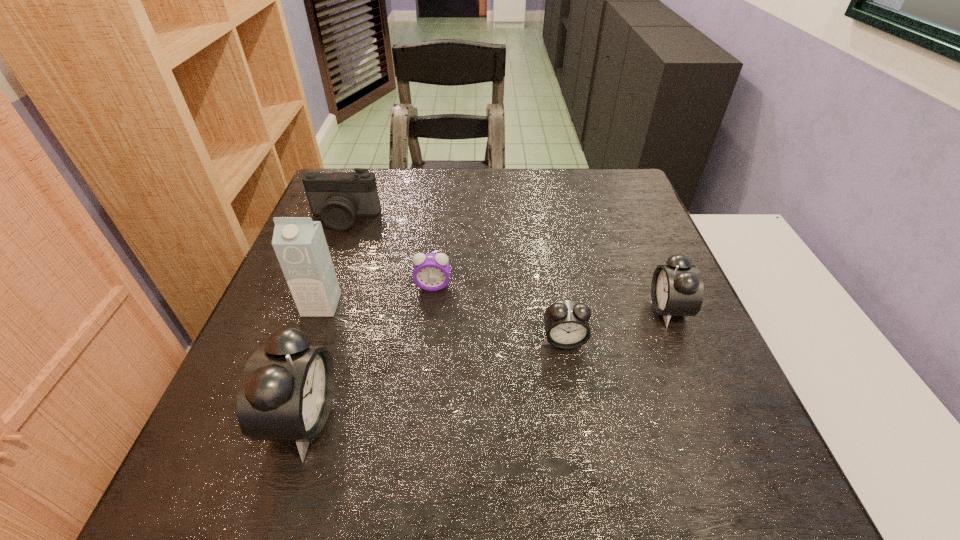
Select which alarm clock is the third closest to the third shortest alarm clock. Please provide its 2D coordinates. Your answer should be formatted as a tuple, i.e. [(x, y)], where the tuple contains the x and y coordinates of a point satisfying the conditions above.

[(286, 390)]

Locate which alarm clock ranks third in proximity to the carton. Please provide its 2D coordinates. Your answer should be formatted as a tuple, i.e. [(x, y)], where the tuple contains the x and y coordinates of a point satisfying the conditions above.

[(566, 322)]

At what (x,y) coordinates should I click in order to perform the action: click on free point that satisfies the following two spatial constraints: 1. on the face of the third alarm clock from right to left; 2. on the front side of the nearest alarm clock. Please return your answer as a coordinate pair (x, y). The height and width of the screenshot is (540, 960). Looking at the image, I should click on (419, 419).